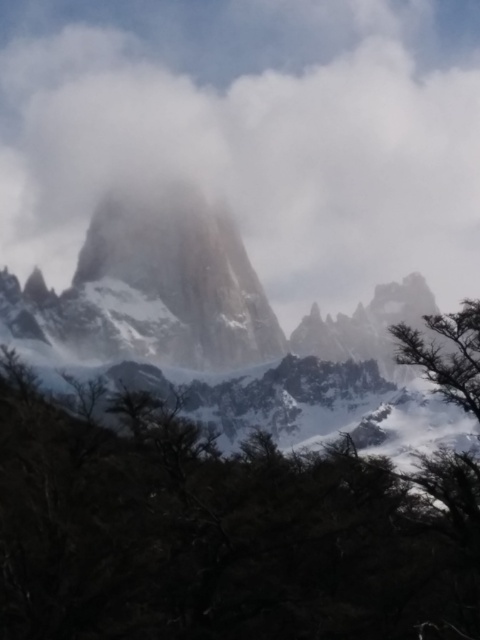
You are standing in front of the mountain scene and want to determine which of the two points, point [443,301] or point [216,220], is closer to you. Based on the image, which point is nearer?

Point [443,301] is closer to you because it is further to the viewer than point [216,220] according to the description.

You are a hiker planning to take a photo of the dark green leafy tree at center and the sandy beige rock at center. Based on their positions, which object should you focus on first to ensure both are in the frame?

The dark green leafy tree at center is located below the sandy beige rock at center, so you should focus on the sandy beige rock at center first to ensure both are in the frame.

You are a hiker planning to take a photo of both the white fluffy cloud at upper center and the dark green leafy tree at center. Given that your camera can only focus on objects within 90 meters of each other, will you be able to capture both in a single shot?

The white fluffy cloud at upper center and dark green leafy tree at center are 90.01 meters apart from each other, so they are just over the 90 meter limit. Your camera cannot focus on both in a single shot since they are slightly too far apart.